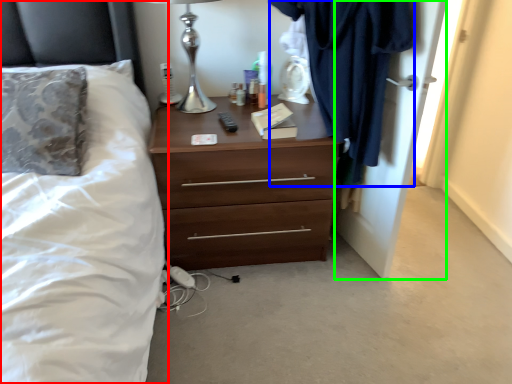
Question: Which object is the farthest from bed (highlighted by a red box)? Choose among these: clothing (highlighted by a blue box) or door (highlighted by a green box).

Choices:
 (A) clothing
 (B) door

Answer: (B)